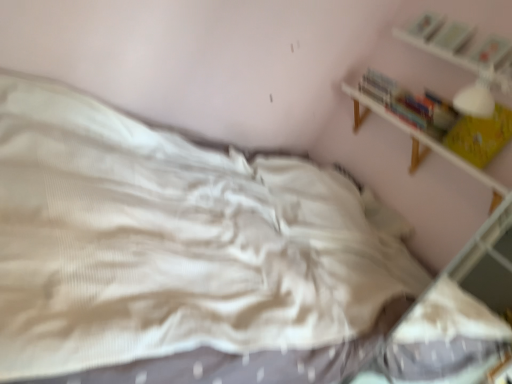
Question: Is yellow paper book at upper right, which is the fourth book in top-to-bottom order, facing towards hardcover book at upper right, positioned as the first book in top-to-bottom order?

Choices:
 (A) no
 (B) yes

Answer: (A)

Question: From the image's perspective, is yellow paper book at upper right, which is the fourth book in top-to-bottom order, beneath hardcover book at upper right, positioned as the first book in top-to-bottom order?

Choices:
 (A) yes
 (B) no

Answer: (A)

Question: From a real-world perspective, is yellow paper book at upper right, which is the fourth book in top-to-bottom order, positioned under hardcover book at upper right, positioned as the first book in top-to-bottom order, based on gravity?

Choices:
 (A) yes
 (B) no

Answer: (A)

Question: Can you confirm if yellow paper book at upper right, which is the fourth book in top-to-bottom order, is smaller than hardcover book at upper right, positioned as the 4th book in bottom-to-top order?

Choices:
 (A) no
 (B) yes

Answer: (A)

Question: Is yellow paper book at upper right, positioned as the first book in bottom-to-top order, positioned far away from hardcover book at upper right, positioned as the 4th book in bottom-to-top order?

Choices:
 (A) yes
 (B) no

Answer: (B)

Question: Can you confirm if yellow paper book at upper right, positioned as the first book in bottom-to-top order, is wider than hardcover book at upper right, positioned as the 4th book in bottom-to-top order?

Choices:
 (A) yes
 (B) no

Answer: (B)

Question: From the image's perspective, is white wooden shelf at upper right on yellow paper book at upper right, which is the fourth book in top-to-bottom order?

Choices:
 (A) yes
 (B) no

Answer: (B)

Question: Is white wooden shelf at upper right next to yellow paper book at upper right, positioned as the first book in bottom-to-top order, and touching it?

Choices:
 (A) no
 (B) yes

Answer: (A)

Question: Is white wooden shelf at upper right further to the viewer compared to yellow paper book at upper right, positioned as the first book in bottom-to-top order?

Choices:
 (A) yes
 (B) no

Answer: (B)

Question: From a real-world perspective, is white wooden shelf at upper right physically above yellow paper book at upper right, which is the fourth book in top-to-bottom order?

Choices:
 (A) yes
 (B) no

Answer: (B)

Question: Can you confirm if white wooden shelf at upper right is smaller than yellow paper book at upper right, positioned as the first book in bottom-to-top order?

Choices:
 (A) no
 (B) yes

Answer: (A)

Question: Can you confirm if white wooden shelf at upper right is shorter than yellow paper book at upper right, which is the fourth book in top-to-bottom order?

Choices:
 (A) yes
 (B) no

Answer: (A)

Question: Is yellow paper book at upper right, which is the fourth book in top-to-bottom order, placed right next to hardcover book at upper right, acting as the third book starting from the bottom?

Choices:
 (A) no
 (B) yes

Answer: (A)